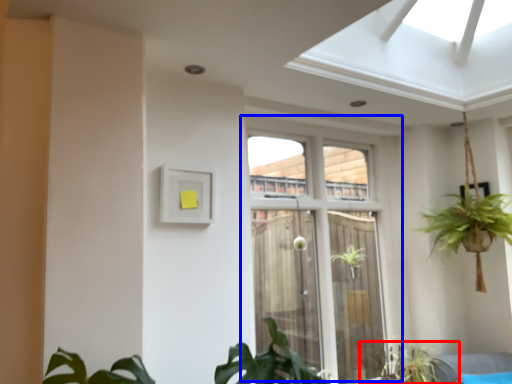
Question: Which object appears closest to the camera in this image, houseplant (highlighted by a red box) or window (highlighted by a blue box)?

Choices:
 (A) houseplant
 (B) window

Answer: (B)